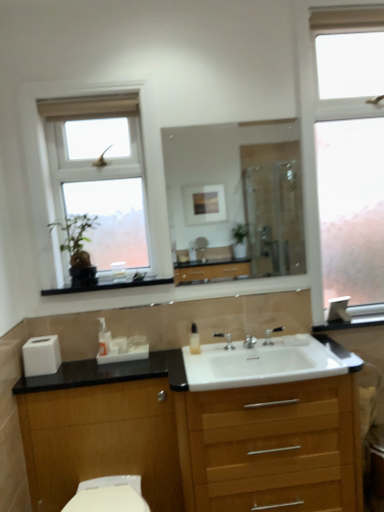
Question: Is translucent plastic soap dispenser at center, acting as the second soap dispenser starting from the left, bigger or smaller than frosted glass window at right, acting as the first window starting from the right?

Choices:
 (A) small
 (B) big

Answer: (A)

Question: From a real-world perspective, is translucent plastic soap dispenser at center, marked as the 1th soap dispenser in a right-to-left arrangement, above or below frosted glass window at right, arranged as the second window when viewed from the left?

Choices:
 (A) above
 (B) below

Answer: (B)

Question: Which is farther from the translucent plastic soap dispenser at center, marked as the second soap dispenser in a right-to-left arrangement?

Choices:
 (A) silver metallic tap at center, the 2th tap positioned from the right
 (B) white matte toilet paper at lower left
 (C) white glass window at upper left, acting as the second window starting from the right
 (D) frosted glass window at right, arranged as the second window when viewed from the left
 (E) silver metallic tap at center, which is the second tap from left to right

Answer: (D)

Question: Which object is positioned farthest from the silver metallic tap at center, the 2th tap positioned from the right?

Choices:
 (A) white glass window at upper left, acting as the second window starting from the right
 (B) wooden chest of drawers at center
 (C) white glossy toilet bowl at lower left
 (D) white glossy sink at center
 (E) frosted glass window at right, arranged as the second window when viewed from the left

Answer: (E)